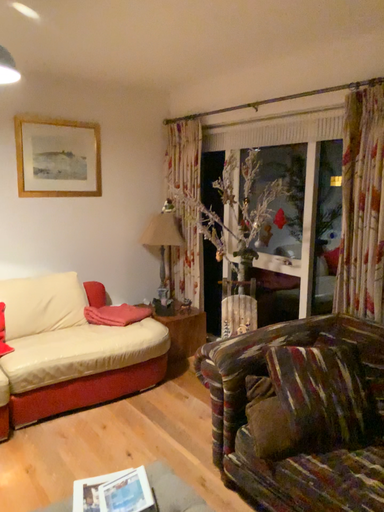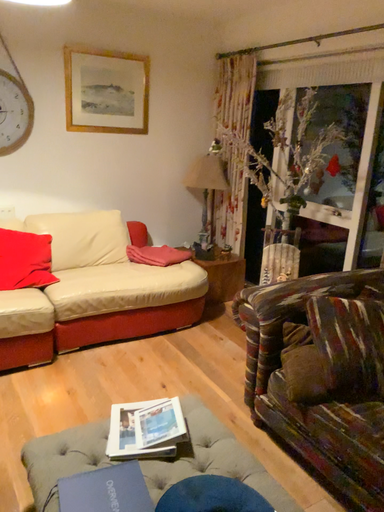
Question: How did the camera likely rotate when shooting the video?

Choices:
 (A) rotated upward
 (B) rotated downward

Answer: (B)